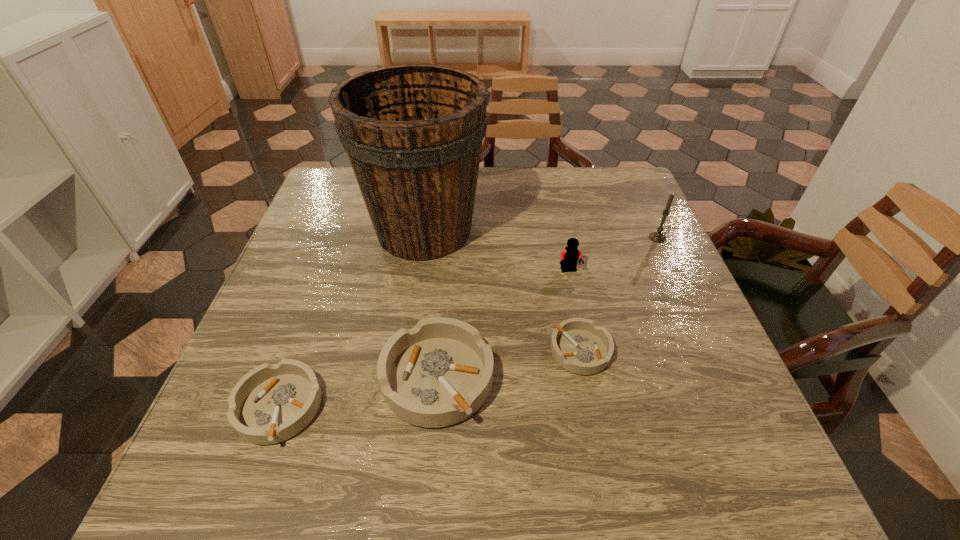
At what (x,y) coordinates should I click in order to perform the action: click on the leftmost ashtray. Please return your answer as a coordinate pair (x, y). The height and width of the screenshot is (540, 960). Looking at the image, I should click on (271, 403).

Find the location of a particular element. The height and width of the screenshot is (540, 960). the second tallest ashtray is located at coordinates (271, 403).

Find the location of `the tallest ashtray`. the tallest ashtray is located at coordinates (440, 372).

At what (x,y) coordinates should I click in order to perform the action: click on the fourth tallest object. Please return your answer as a coordinate pair (x, y). This screenshot has width=960, height=540. Looking at the image, I should click on (440, 372).

Locate an element on the screen. The width and height of the screenshot is (960, 540). the shortest object is located at coordinates (578, 345).

Locate an element on the screen. This screenshot has width=960, height=540. the shortest ashtray is located at coordinates (578, 345).

What are the coordinates of `bucket` in the screenshot? It's located at (413, 133).

Locate an element on the screen. Lego is located at coordinates (570, 255).

This screenshot has width=960, height=540. I want to click on the second tallest object, so click(x=658, y=237).

The image size is (960, 540). What are the coordinates of `candle` in the screenshot? It's located at (658, 237).